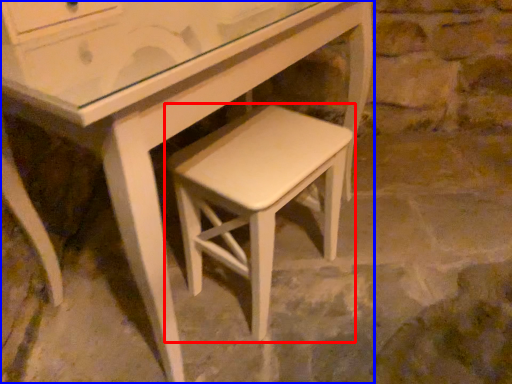
Question: Which object appears farthest to the camera in this image, stool (highlighted by a red box) or table (highlighted by a blue box)?

Choices:
 (A) stool
 (B) table

Answer: (B)